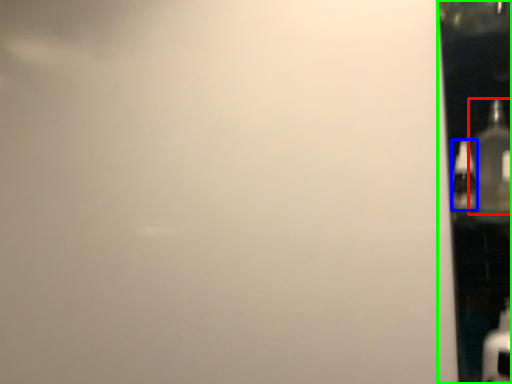
Question: Based on their relative distances, which object is farther from bottle (highlighted by a red box)? Choose from bottle (highlighted by a blue box) and glass door (highlighted by a green box).

Choices:
 (A) bottle
 (B) glass door

Answer: (B)